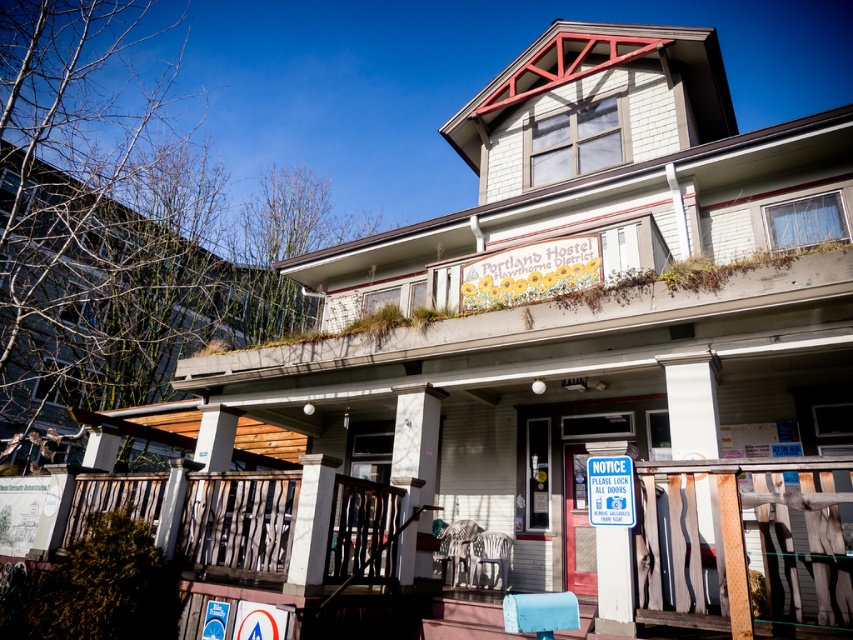
Question: Does wooden at lower right have a larger size compared to blue plastic sign at center?

Choices:
 (A) no
 (B) yes

Answer: (B)

Question: Among these objects, which one is nearest to the camera?

Choices:
 (A) blue plastic sign at center
 (B) wooden at lower right

Answer: (B)

Question: Among these points, which one is farthest from the camera?

Choices:
 (A) (717, 563)
 (B) (611, 483)

Answer: (B)

Question: From the image, what is the correct spatial relationship of wooden at lower right in relation to blue plastic sign at center?

Choices:
 (A) below
 (B) above

Answer: (A)

Question: Which point is farther to the camera?

Choices:
 (A) wooden at lower right
 (B) blue plastic sign at center

Answer: (B)

Question: Is wooden at lower right below blue plastic sign at center?

Choices:
 (A) yes
 (B) no

Answer: (A)